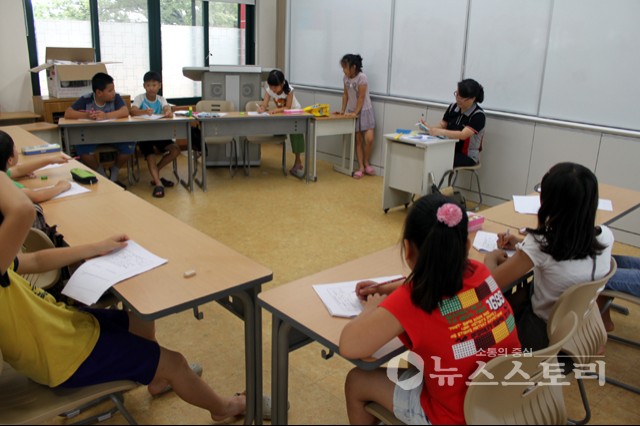
Locate an element on the screen. The height and width of the screenshot is (426, 640). chairs is located at coordinates (477, 166), (592, 346), (628, 301), (511, 390), (84, 395), (43, 240), (212, 105), (252, 105).